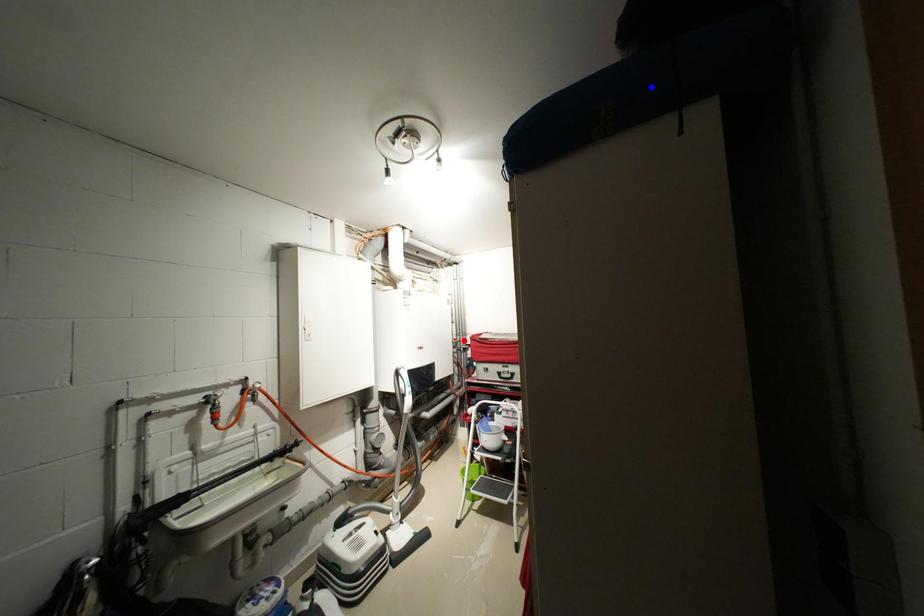
Question: Which of the two points in the image is closer to the camera?

Choices:
 (A) Blue point is closer.
 (B) Red point is closer.

Answer: (A)